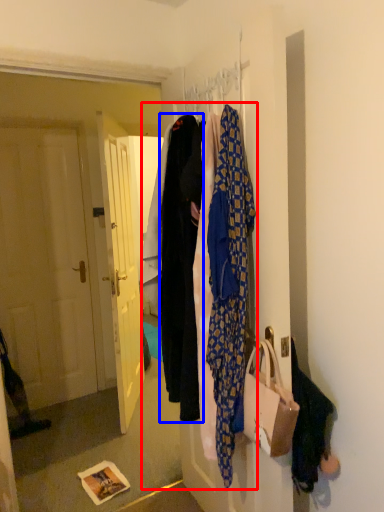
Question: Which object is closer to the camera taking this photo, closet (highlighted by a red box) or garment (highlighted by a blue box)?

Choices:
 (A) closet
 (B) garment

Answer: (A)